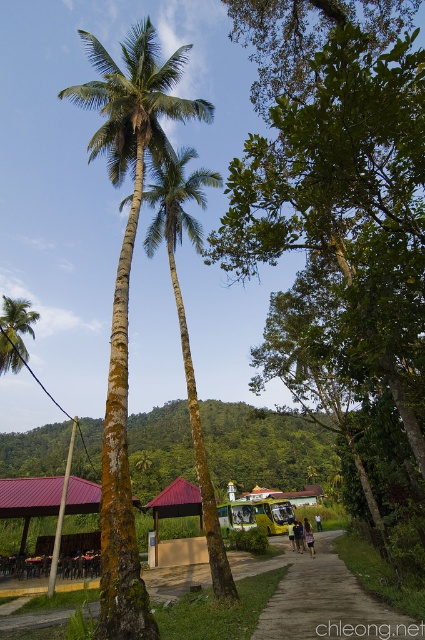
Question: Which object is positioned farthest from the brown wooden hut at center?

Choices:
 (A) brown thatched roof at center
 (B) green rough bark coconut tree at center
 (C) brown dirt path at center

Answer: (B)

Question: Is brown wooden hut at center smaller than brown thatched roof at center?

Choices:
 (A) yes
 (B) no

Answer: (B)

Question: Which object appears closest to the camera in this image?

Choices:
 (A) green bark palm trees at center
 (B) brown thatched roof at center

Answer: (A)

Question: Can you confirm if green rough bark coconut tree at center is positioned above brown dirt path at center?

Choices:
 (A) yes
 (B) no

Answer: (A)

Question: Can you confirm if green leafy tree at center is positioned to the right of green rough bark coconut tree at center?

Choices:
 (A) yes
 (B) no

Answer: (A)

Question: Which point is farther to the camera?

Choices:
 (A) (166, 496)
 (B) (33, 332)

Answer: (B)